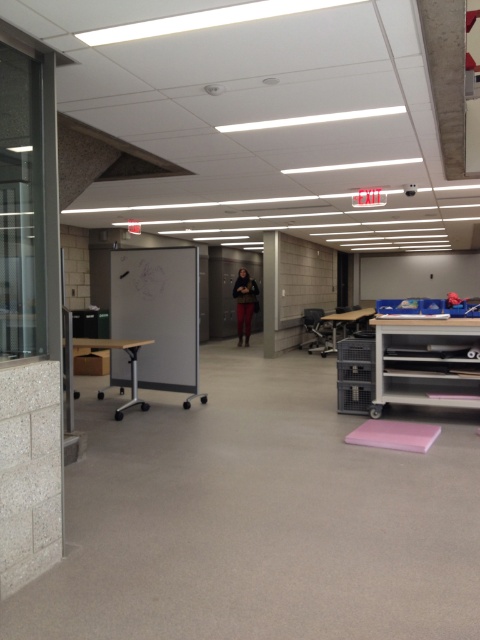
You are trying to place a pink foam yoga mat at lower center next to a white concrete pillar at center. Based on their widths, will the yoga mat fit next to the pillar without overlapping?

The pink foam yoga mat at lower center is wider than the white concrete pillar at center, so placing them side by side would require more space. The yoga mat might not fit next to the pillar without overlapping since its width exceeds the pillar.

You are a fitness instructor preparing for a class and see the pink foam yoga mat at lower center and the white concrete pillar at center. Which object is closer to the right side of the room?

The pink foam yoga mat at lower center is positioned on the right side of the white concrete pillar at center, so it is closer to the right side of the room.